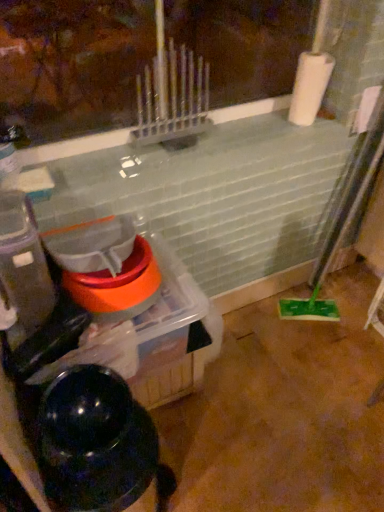
What do you see at coordinates (309, 86) in the screenshot? I see `white matte paper towel at upper right` at bounding box center [309, 86].

The height and width of the screenshot is (512, 384). Describe the element at coordinates (24, 266) in the screenshot. I see `translucent plastic container at left` at that location.

Where is `translucent plastic container at left`? The image size is (384, 512). translucent plastic container at left is located at coordinates [24, 266].

Locate an element on the screen. The width and height of the screenshot is (384, 512). white matte toilet paper at upper right is located at coordinates (366, 108).

Describe the element at coordinates (366, 108) in the screenshot. This screenshot has width=384, height=512. I see `white matte toilet paper at upper right` at that location.

This screenshot has height=512, width=384. What are the coordinates of `white matte paper towel at upper right` in the screenshot? It's located at (309, 86).

Where is `paper towel positioned vertically above the translucent plastic container at left (from a real-world perspective)`? This screenshot has height=512, width=384. paper towel positioned vertically above the translucent plastic container at left (from a real-world perspective) is located at coordinates (309, 86).

Measure the distance between translucent plastic container at left and white matte paper towel at upper right.

translucent plastic container at left and white matte paper towel at upper right are 38.27 inches apart from each other.

Who is smaller, translucent plastic container at left or white matte paper towel at upper right?

white matte paper towel at upper right.

Considering the relative positions of translucent plastic container at left and white matte paper towel at upper right in the image provided, is translucent plastic container at left to the left of white matte paper towel at upper right from the viewer's perspective?

Correct, you'll find translucent plastic container at left to the left of white matte paper towel at upper right.

From the image's perspective, is white matte toilet paper at upper right above translucent plastic container at left?

Indeed, from the image's perspective, white matte toilet paper at upper right is shown above translucent plastic container at left.

Considering the relative sizes of white matte toilet paper at upper right and translucent plastic container at left in the image provided, is white matte toilet paper at upper right wider than translucent plastic container at left?

No.

Are white matte toilet paper at upper right and translucent plastic container at left far apart?

Yes, white matte toilet paper at upper right and translucent plastic container at left are quite far apart.

Find the location of a particular element. The width and height of the screenshot is (384, 512). toilet paper above the translucent plastic container at left (from the image's perspective) is located at coordinates (366, 108).

This screenshot has height=512, width=384. In order to click on water heater that is under the white matte paper towel at upper right (from a real-world perspective) in this screenshot , I will do `click(94, 442)`.

From the image's perspective, which one is positioned higher, white matte paper towel at upper right or black glossy water heater at lower left?

From the image's view, white matte paper towel at upper right is above.

Is point (311, 118) in front of point (122, 388)?

No, (311, 118) is further to viewer.

Is white matte paper towel at upper right thinner than black glossy water heater at lower left?

Correct, the width of white matte paper towel at upper right is less than that of black glossy water heater at lower left.

Is point (93, 373) farther from camera compared to point (8, 221)?

Yes, point (93, 373) is behind point (8, 221).

How far apart are black glossy water heater at lower left and translucent plastic container at left?

black glossy water heater at lower left and translucent plastic container at left are 11.32 inches apart from each other.

Can you confirm if black glossy water heater at lower left is shorter than translucent plastic container at left?

No, black glossy water heater at lower left is not shorter than translucent plastic container at left.

From a real-world perspective, is black glossy water heater at lower left positioned under translucent plastic container at left based on gravity?

Yes.

Which object is positioned more to the left, white matte toilet paper at upper right or white matte paper towel at upper right?

white matte paper towel at upper right is more to the left.

Is white matte toilet paper at upper right positioned beyond the bounds of white matte paper towel at upper right?

white matte toilet paper at upper right lies outside white matte paper towel at upper right's area.

Which object is thinner, white matte toilet paper at upper right or white matte paper towel at upper right?

Thinner between the two is white matte toilet paper at upper right.

Between translucent plastic container at left and black glossy water heater at lower left, which one appears on the left side from the viewer's perspective?

Positioned to the left is translucent plastic container at left.

Does point (4, 237) come in front of point (74, 408)?

Yes, it is in front of point (74, 408).

Is black glossy water heater at lower left at the back of translucent plastic container at left?

translucent plastic container at left does not have its back to black glossy water heater at lower left.

How many degrees apart are the facing directions of translucent plastic container at left and black glossy water heater at lower left?

translucent plastic container at left and black glossy water heater at lower left are facing 0.000529 degrees away from each other.

Which is more to the left, translucent plastic container at left or white matte toilet paper at upper right?

Positioned to the left is translucent plastic container at left.

From a real-world perspective, which is physically above, translucent plastic container at left or white matte toilet paper at upper right?

white matte toilet paper at upper right is physically above.

From the picture: Considering the relative sizes of translucent plastic container at left and white matte toilet paper at upper right in the image provided, is translucent plastic container at left bigger than white matte toilet paper at upper right?

Yes, translucent plastic container at left is bigger than white matte toilet paper at upper right.

At what (x,y) coordinates should I click in order to perform the action: click on appliance below the white matte paper towel at upper right (from a real-world perspective). Please return your answer as a coordinate pair (x, y). The width and height of the screenshot is (384, 512). Looking at the image, I should click on (24, 266).

Image resolution: width=384 pixels, height=512 pixels. Identify the location of toilet paper lying above the translucent plastic container at left (from the image's perspective). (366, 108).

Estimate the real-world distances between objects in this image. Which object is further from black glossy water heater at lower left, white matte toilet paper at upper right or translucent plastic container at left?

white matte toilet paper at upper right.

Considering their positions, is black glossy water heater at lower left positioned further to translucent plastic container at left than white matte toilet paper at upper right?

white matte toilet paper at upper right is further to translucent plastic container at left.

Considering their positions, is black glossy water heater at lower left positioned closer to white matte toilet paper at upper right than translucent plastic container at left?

translucent plastic container at left is closer to white matte toilet paper at upper right.

From the image, which object appears to be nearer to translucent plastic container at left, white matte paper towel at upper right or black glossy water heater at lower left?

black glossy water heater at lower left is closer to translucent plastic container at left.

Looking at the image, which one is located further to white matte paper towel at upper right, translucent plastic container at left or white matte toilet paper at upper right?

translucent plastic container at left lies further to white matte paper towel at upper right than the other object.

From the image, which object appears to be farther from white matte toilet paper at upper right, translucent plastic container at left or black glossy water heater at lower left?

Among the two, black glossy water heater at lower left is located further to white matte toilet paper at upper right.

When comparing their distances from white matte paper towel at upper right, does black glossy water heater at lower left or translucent plastic container at left seem closer?

translucent plastic container at left.

Based on the photo, when comparing their distances from black glossy water heater at lower left, does white matte paper towel at upper right or white matte toilet paper at upper right seem closer?

white matte paper towel at upper right lies closer to black glossy water heater at lower left than the other object.

The height and width of the screenshot is (512, 384). Identify the location of paper towel between translucent plastic container at left and white matte toilet paper at upper right. (309, 86).

This screenshot has width=384, height=512. In order to click on water heater between translucent plastic container at left and white matte toilet paper at upper right in this screenshot , I will do `click(94, 442)`.

Locate an element on the screen. The image size is (384, 512). appliance that lies between white matte paper towel at upper right and black glossy water heater at lower left from top to bottom is located at coordinates (24, 266).

Locate an element on the screen. The width and height of the screenshot is (384, 512). toilet paper between white matte paper towel at upper right and black glossy water heater at lower left from top to bottom is located at coordinates (366, 108).